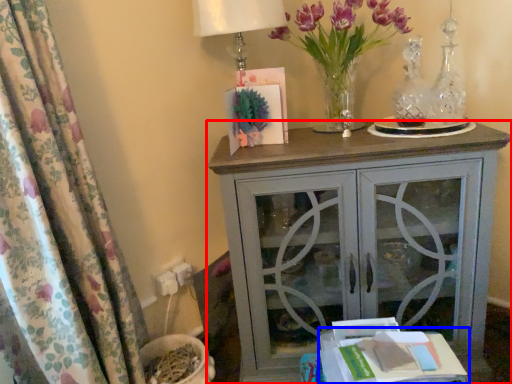
Question: Which object appears closest to the camera in this image, nightstand (highlighted by a red box) or table (highlighted by a blue box)?

Choices:
 (A) nightstand
 (B) table

Answer: (B)